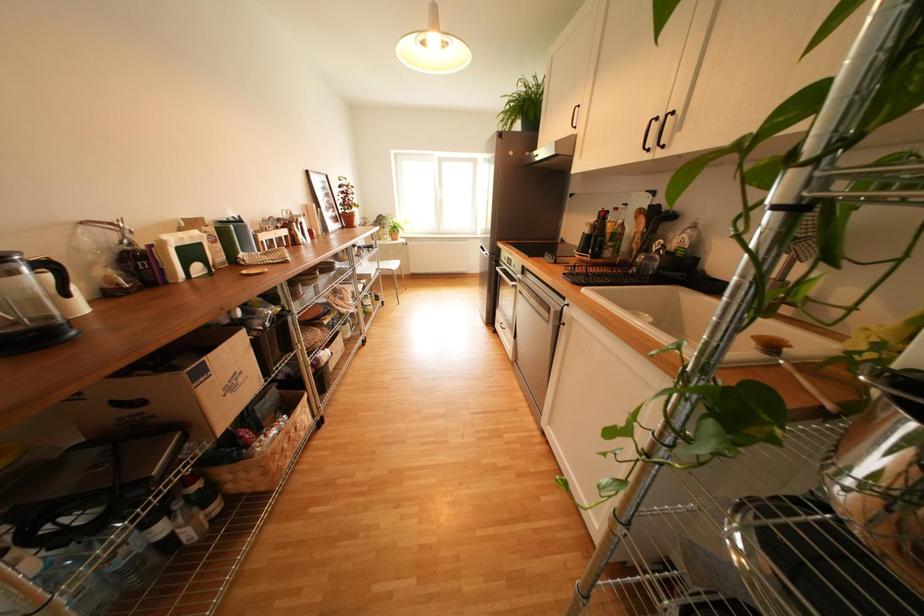
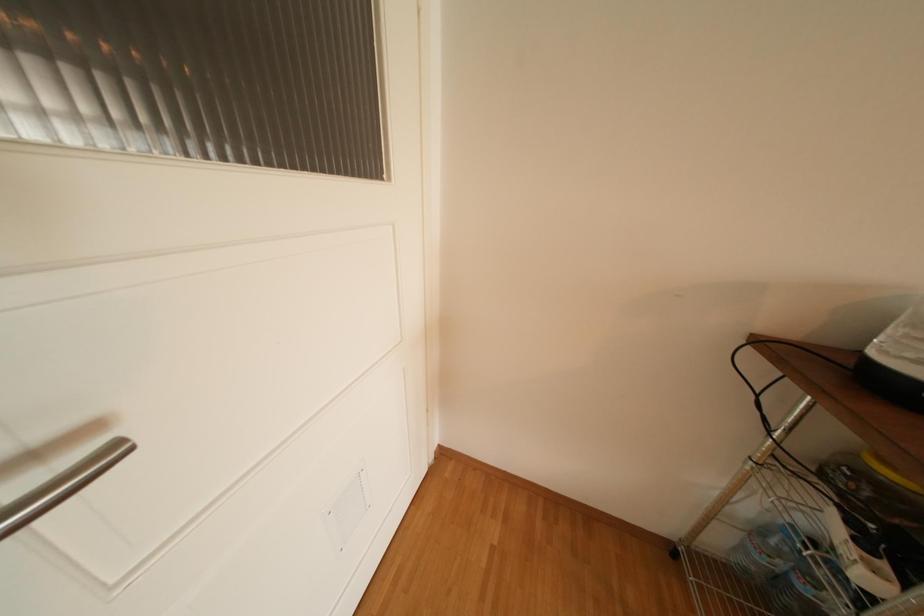
The first image is from the beginning of the video and the second image is from the end. How did the camera likely rotate when shooting the video?

The rotation direction of the camera is left-down.